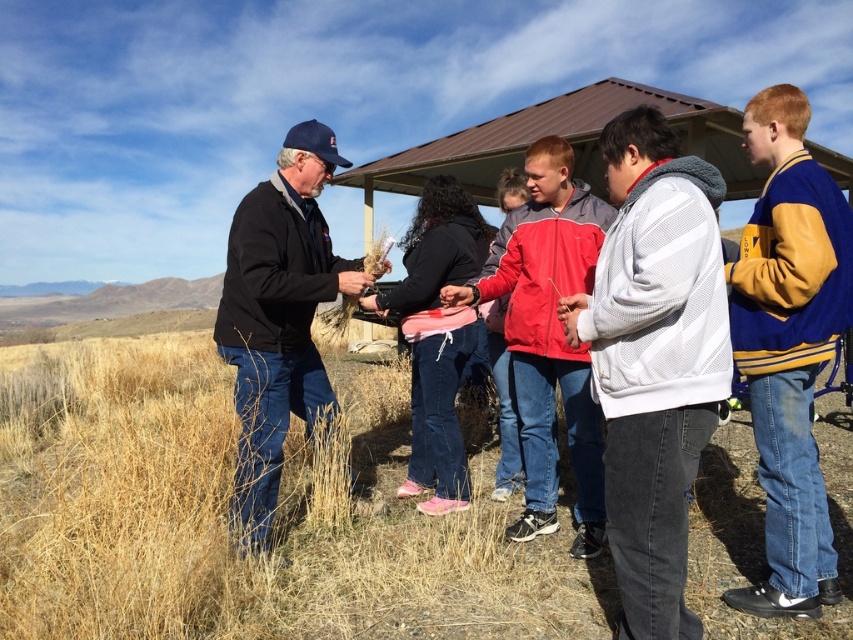
Can you confirm if dry grass at center is positioned above red jacket at center?

No.

Between dry grass at center and red jacket at center, which one appears on the left side from the viewer's perspective?

From the viewer's perspective, dry grass at center appears more on the left side.

At what (x,y) coordinates should I click in order to perform the action: click on dry grass at center. Please return your answer as a coordinate pair (x, y). The image size is (853, 640). Looking at the image, I should click on (225, 516).

Does dry grass at center appear under blue and yellow varsity jacket at right?

Yes.

Is point (70, 403) positioned before point (822, 538)?

That is False.

This screenshot has width=853, height=640. Describe the element at coordinates (225, 516) in the screenshot. I see `dry grass at center` at that location.

What are the coordinates of `dry grass at center` in the screenshot? It's located at (225, 516).

Is white mesh jacket at center above blue and yellow varsity jacket at right?

Actually, white mesh jacket at center is below blue and yellow varsity jacket at right.

Which is more to the right, white mesh jacket at center or blue and yellow varsity jacket at right?

blue and yellow varsity jacket at right

What do you see at coordinates (654, 358) in the screenshot? I see `white mesh jacket at center` at bounding box center [654, 358].

This screenshot has width=853, height=640. Identify the location of white mesh jacket at center. (654, 358).